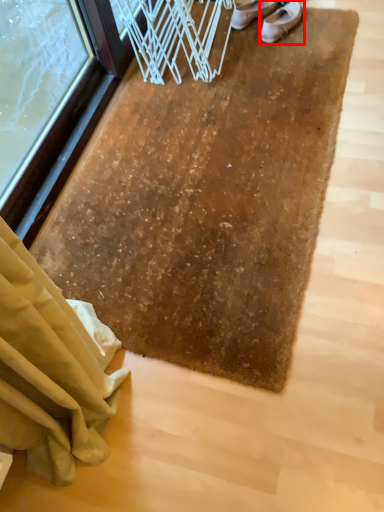
Question: From the image's perspective, where is footwear (annotated by the red box) located in relation to footwear in the image?

Choices:
 (A) above
 (B) below

Answer: (B)